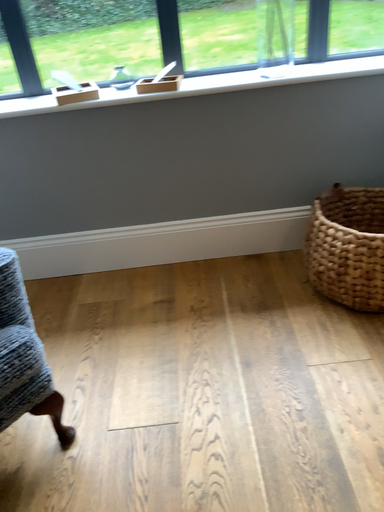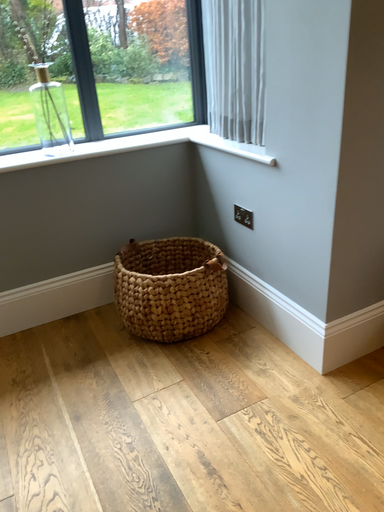
Question: How did the camera likely rotate when shooting the video?

Choices:
 (A) rotated downward
 (B) rotated upward

Answer: (B)